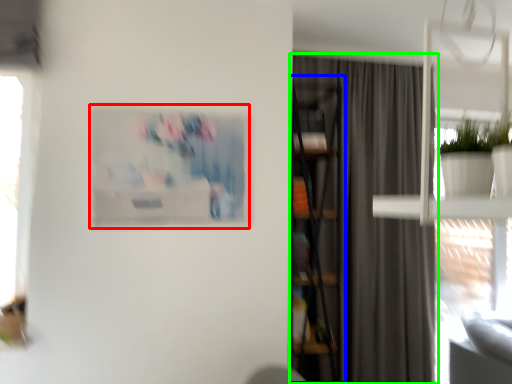
Question: Considering the real-world distances, which object is closest to picture frame (highlighted by a red box)? bookcase (highlighted by a blue box) or curtain (highlighted by a green box).

Choices:
 (A) bookcase
 (B) curtain

Answer: (A)